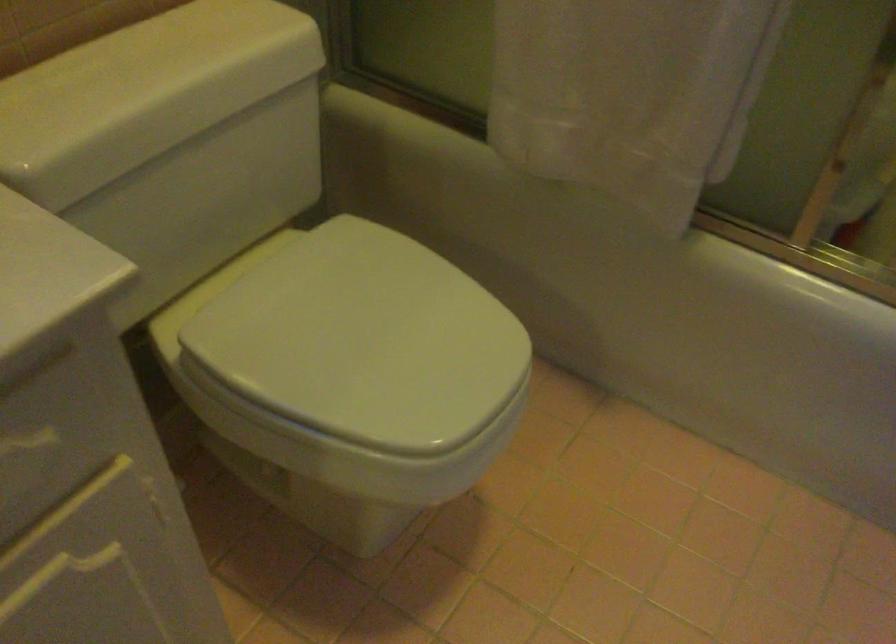
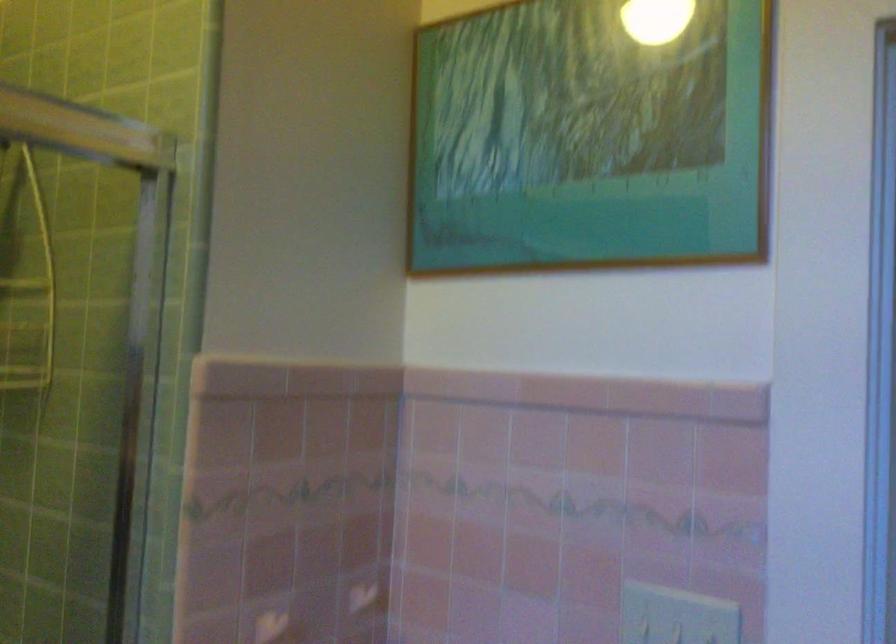
Question: The camera is either moving clockwise (left) or counter-clockwise (right) around the object. The first image is from the beginning of the video and the second image is from the end. Is the camera moving left or right when shooting the video?

Choices:
 (A) Left
 (B) Right

Answer: (A)